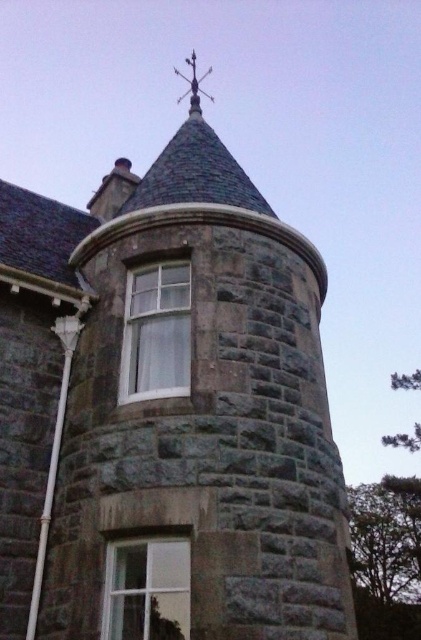
You are standing in front of the stone building and want to know which window is closer to you. Can you tell me which one is closer between the white glass window at center and the clear glass window at center?

The white glass window at center is closer to you because it is further to the viewer than the clear glass window at center.